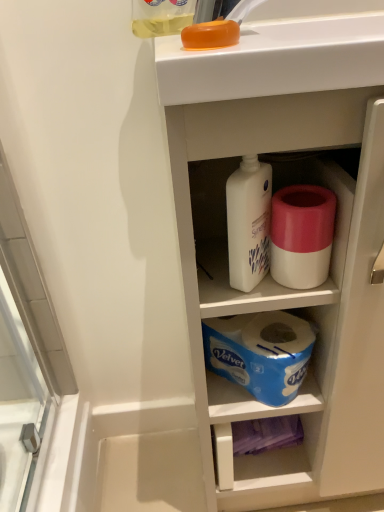
Question: Is white plastic cabinet at upper center at the left side of translucent yellow liquid at upper center?

Choices:
 (A) no
 (B) yes

Answer: (A)

Question: From a real-world perspective, is white plastic cabinet at upper center on top of translucent yellow liquid at upper center?

Choices:
 (A) yes
 (B) no

Answer: (B)

Question: Can you confirm if white plastic cabinet at upper center is shorter than translucent yellow liquid at upper center?

Choices:
 (A) yes
 (B) no

Answer: (B)

Question: Is white plastic cabinet at upper center bigger than translucent yellow liquid at upper center?

Choices:
 (A) no
 (B) yes

Answer: (B)

Question: Is white plastic cabinet at upper center directly adjacent to translucent yellow liquid at upper center?

Choices:
 (A) yes
 (B) no

Answer: (B)

Question: Is white plastic cabinet at upper center positioned with its back to translucent yellow liquid at upper center?

Choices:
 (A) no
 (B) yes

Answer: (A)

Question: Is white matte toilet paper at center a part of white plastic cabinet at upper center?

Choices:
 (A) no
 (B) yes

Answer: (B)

Question: Does white plastic cabinet at upper center have a greater height compared to white matte toilet paper at center?

Choices:
 (A) no
 (B) yes

Answer: (B)

Question: Does white plastic cabinet at upper center have a larger size compared to white matte toilet paper at center?

Choices:
 (A) no
 (B) yes

Answer: (B)

Question: Is the depth of white plastic cabinet at upper center less than that of white matte toilet paper at center?

Choices:
 (A) no
 (B) yes

Answer: (B)

Question: Is white plastic cabinet at upper center to the left of white matte toilet paper at center from the viewer's perspective?

Choices:
 (A) yes
 (B) no

Answer: (B)

Question: Considering the relative sizes of white plastic cabinet at upper center and white matte toilet paper at center in the image provided, is white plastic cabinet at upper center smaller than white matte toilet paper at center?

Choices:
 (A) yes
 (B) no

Answer: (B)

Question: Does translucent yellow liquid at upper center come behind white matte toilet paper at center?

Choices:
 (A) no
 (B) yes

Answer: (A)